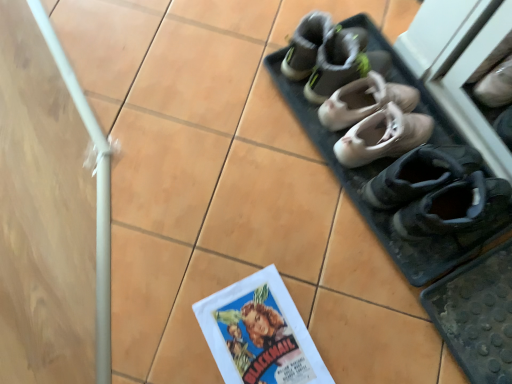
Question: From the image's perspective, is black suede shoes at lower right, the fifth footwear from the top, positioned above or below light beige leather ballet flats at center, the second footwear from the top?

Choices:
 (A) below
 (B) above

Answer: (A)

Question: In terms of width, does black suede shoes at lower right, the fifth footwear from the top, look wider or thinner when compared to light beige leather ballet flats at center, which is counted as the 4th footwear, starting from the bottom?

Choices:
 (A) thin
 (B) wide

Answer: (B)

Question: Which is farther from the matte paper comic book at lower center?

Choices:
 (A) gray suede sneakers at upper center, which is the fifth footwear in bottom-to-top order
 (B) gray fabric shoes at upper center
 (C) light beige leather ballet shoes at center, the 3th footwear viewed from the top
 (D) black suede shoes at lower right, positioned as the 1th footwear in bottom-to-top order
 (E) light beige leather ballet flats at center, the second footwear from the top

Answer: (B)

Question: Considering the real-world distances, which object is closest to the light beige leather ballet shoes at center, the third footwear in the bottom-to-top sequence?

Choices:
 (A) light beige leather ballet flats at center, the second footwear from the top
 (B) black suede shoes at lower right, the fifth footwear from the top
 (C) matte paper comic book at lower center
 (D) matte gray sneakers at upper right, the 4th footwear when ordered from top to bottom
 (E) gray fabric shoes at upper center

Answer: (A)